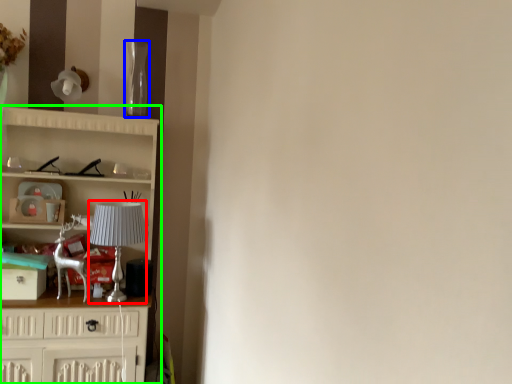
Question: Based on their relative distances, which object is farther from lamp (highlighted by a red box)? Choose from glass vase (highlighted by a blue box) and cupboard (highlighted by a green box).

Choices:
 (A) glass vase
 (B) cupboard

Answer: (A)